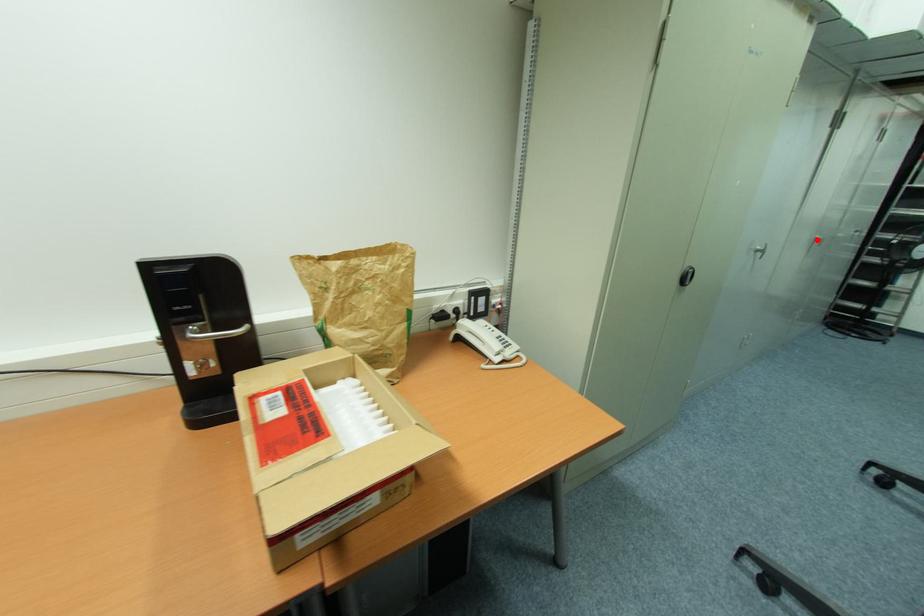
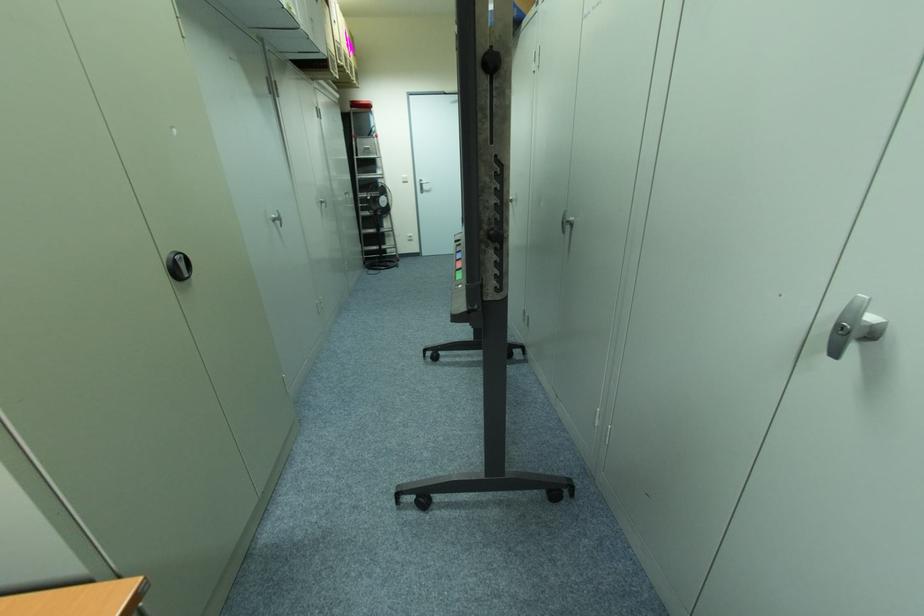
The point at the highlighted location is marked in the first image. Where is the corresponding point in the second image?

(322, 203)